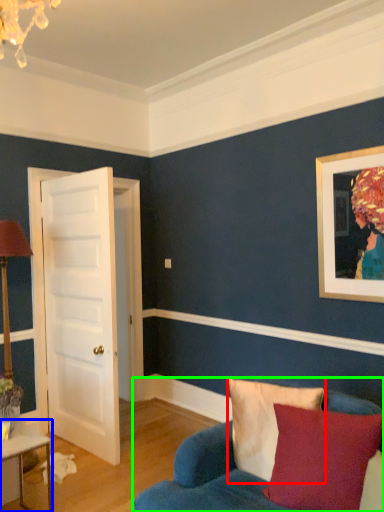
Question: Which is farther away from pillow (highlighted by a red box)? table (highlighted by a blue box) or studio couch (highlighted by a green box)?

Choices:
 (A) table
 (B) studio couch

Answer: (A)